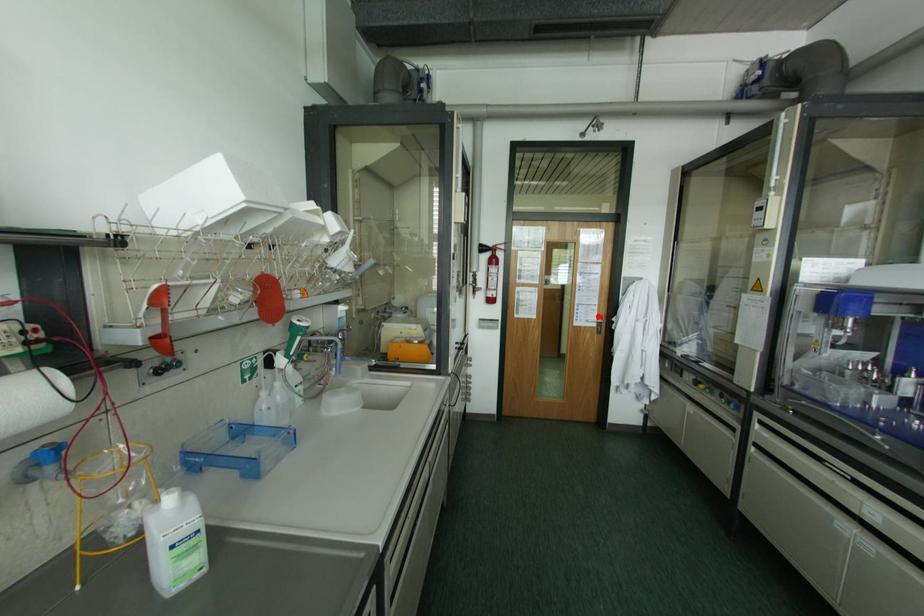
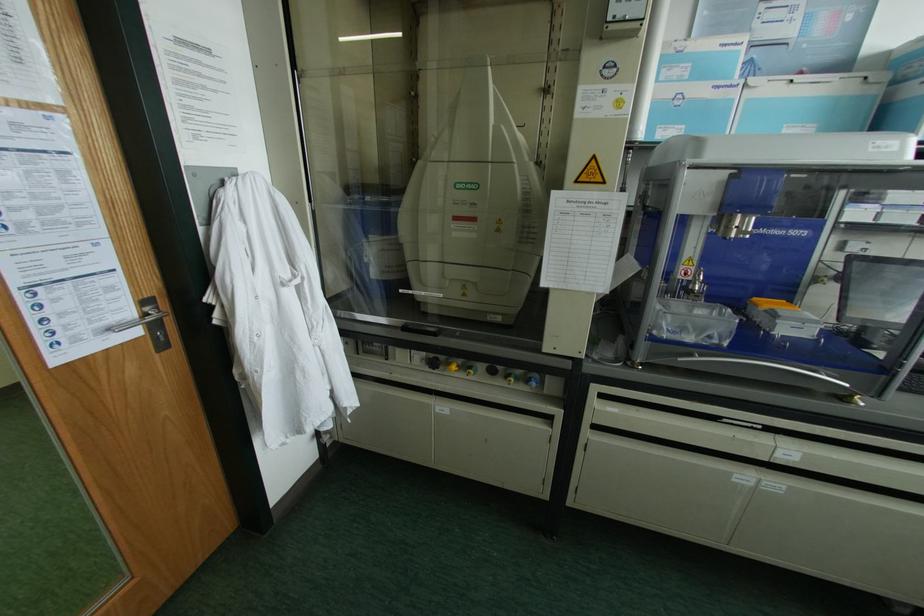
Find the pixel in the second image that matches the highlighted location in the first image.

(142, 302)